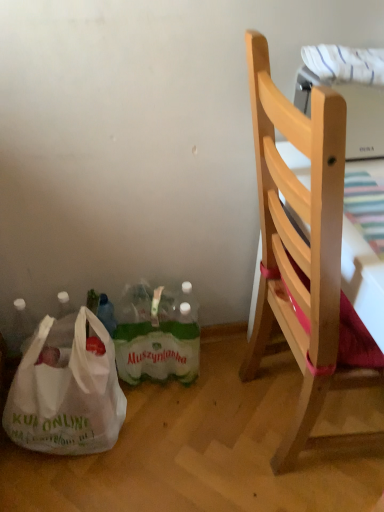
The height and width of the screenshot is (512, 384). What are the coordinates of `free space in front of green plastic bottles at lower center` in the screenshot? It's located at (162, 434).